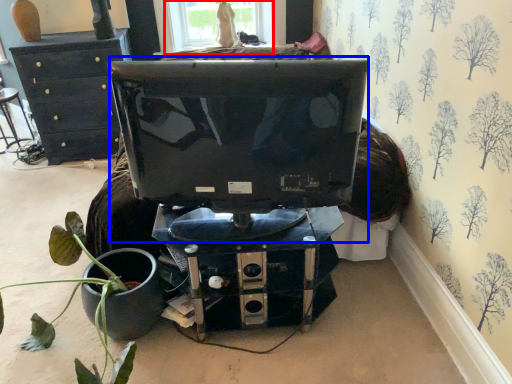
Question: Which object appears farthest to the camera in this image, window (highlighted by a red box) or computer monitor (highlighted by a blue box)?

Choices:
 (A) window
 (B) computer monitor

Answer: (A)